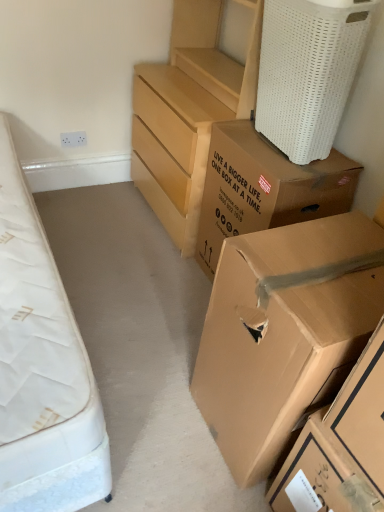
Question: Is point (283, 6) positioned closer to the camera than point (253, 84)?

Choices:
 (A) closer
 (B) farther

Answer: (A)

Question: Is white woven laundry basket at upper right inside or outside of matte wood chest of drawers at center?

Choices:
 (A) outside
 (B) inside

Answer: (A)

Question: Based on their relative distances, which object is nearer to the brown cardboard box at lower right, positioned as the 2th box in bottom-to-top order?

Choices:
 (A) brown cardboard box at upper right, the 3th box in the bottom-to-top sequence
 (B) white woven laundry basket at upper right
 (C) matte wood chest of drawers at center
 (D) brown cardboard box at lower right, the third box from the top

Answer: (D)

Question: Which object is positioned farthest from the matte wood chest of drawers at center?

Choices:
 (A) white woven laundry basket at upper right
 (B) brown cardboard box at lower right, the first box positioned from the bottom
 (C) brown cardboard box at lower right, positioned as the 2th box in bottom-to-top order
 (D) brown cardboard box at upper right, positioned as the 1th box in top-to-bottom order

Answer: (B)